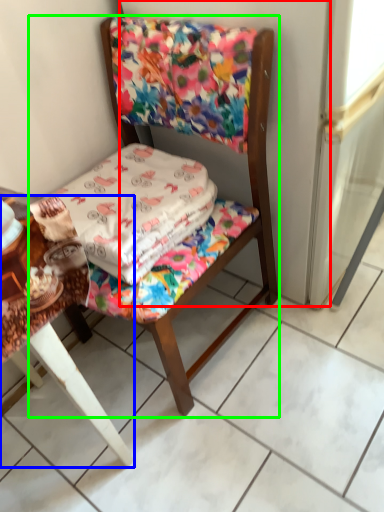
Question: Which object is the farthest from screen door (highlighted by a red box)? Choose among these: table (highlighted by a blue box) or chair (highlighted by a green box).

Choices:
 (A) table
 (B) chair

Answer: (A)